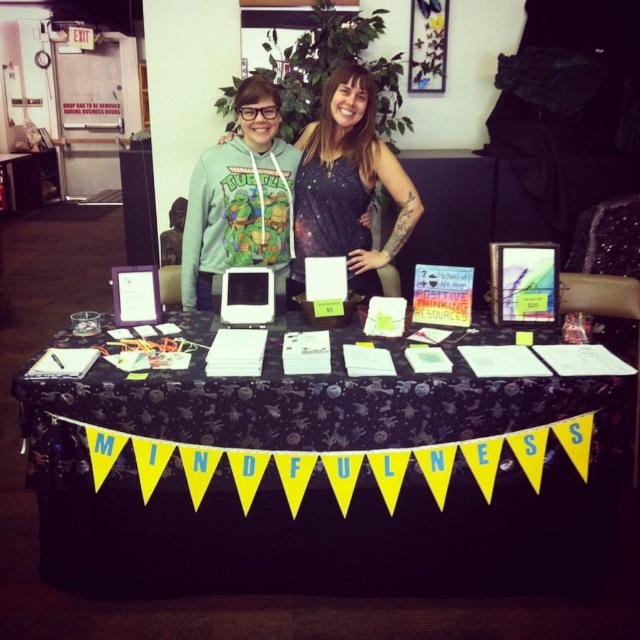
You are a visitor at an event and want to know if you can place a small notebook on the black fabric table at center without it touching the black galaxy print dress at center. Based on their heights, is this possible?

The black fabric table at center is taller than the black galaxy print dress at center, so placing a small notebook on the table would not cause it to touch the dress.

You are organizing a charity event and need to arrange two volunteers, the teal fabric hoodie at center and the black galaxy print dress at center, to stand in front of the booth. Based on their current positions, which volunteer is on the left side?

The black galaxy print dress at center is on the left side because the teal fabric hoodie at center is positioned on the right side of it.

You are a visitor at an event and want to approach the mindfulness booth. You see the black fabric table at center and the teal fabric hoodie at center. Which object is taller?

The black fabric table at center is taller than the teal fabric hoodie at center.